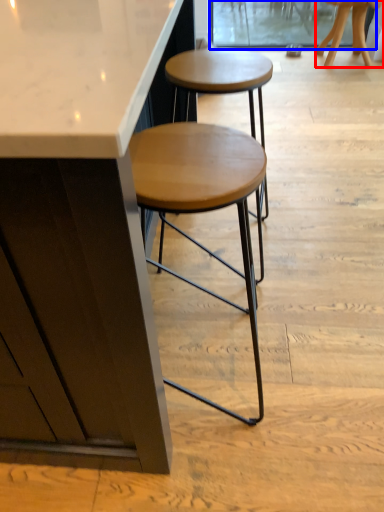
Question: Which object appears closest to the camera in this image, stool (highlighted by a red box) or screen door (highlighted by a blue box)?

Choices:
 (A) stool
 (B) screen door

Answer: (A)